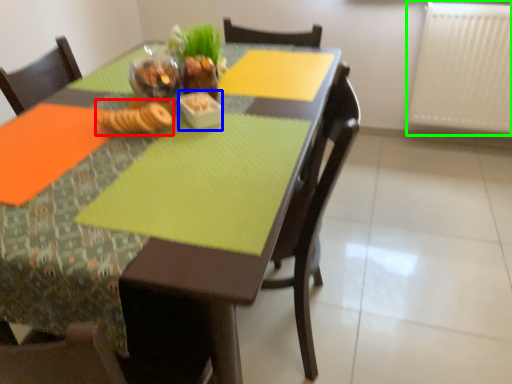
Question: Based on their relative distances, which object is farther from food (highlighted by a red box)? Choose from tableware (highlighted by a blue box) and radiator (highlighted by a green box).

Choices:
 (A) tableware
 (B) radiator

Answer: (B)